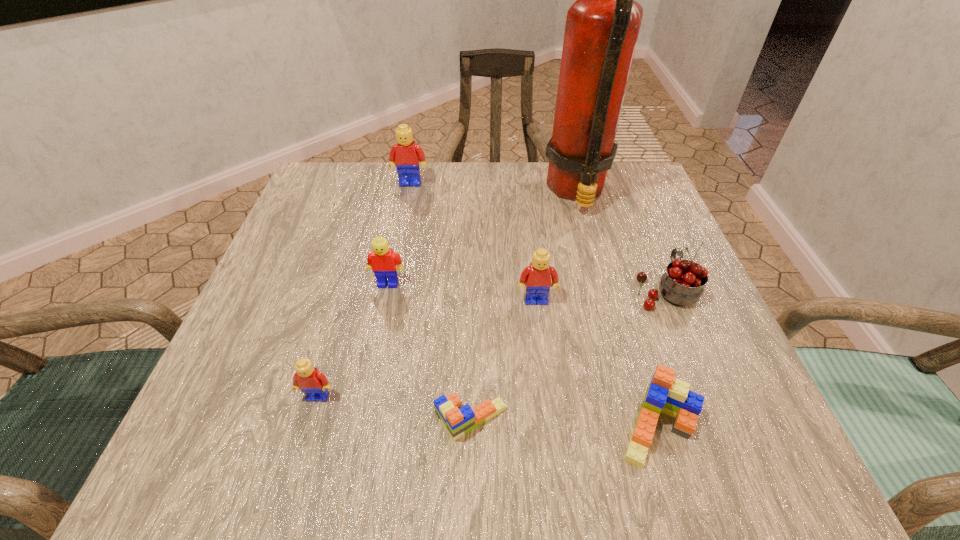
Find the location of `free location located on the handle side of the red cherry`. free location located on the handle side of the red cherry is located at coordinates [x=640, y=228].

Image resolution: width=960 pixels, height=540 pixels. In order to click on vacant space located on the handle side of the red cherry in this screenshot , I will do `click(636, 217)`.

You are a GUI agent. You are given a task and a screenshot of the screen. Output one action in this format:
    pyautogui.click(x=<x>, y=<y>)
    Task: Click on the vacant point located on the handle side of the red cherry
    This screenshot has height=540, width=960.
    Given the screenshot: What is the action you would take?
    pyautogui.click(x=636, y=220)

The height and width of the screenshot is (540, 960). Identify the location of vacant point located 0.060m on the front-facing side of the smallest yellow Lego. (305, 442).

Identify the location of vacant space located on the left of the bigger orange Lego. Image resolution: width=960 pixels, height=540 pixels. (464, 428).

Where is `free spot located on the right of the smaller orange Lego`? Image resolution: width=960 pixels, height=540 pixels. free spot located on the right of the smaller orange Lego is located at coordinates (691, 420).

Where is `fire extinguisher at the far edge`? The image size is (960, 540). fire extinguisher at the far edge is located at coordinates (602, 26).

Locate an element on the screen. The width and height of the screenshot is (960, 540). Lego that is positioned at the far edge is located at coordinates (405, 155).

Where is `object that is positioned at the left edge`? The width and height of the screenshot is (960, 540). object that is positioned at the left edge is located at coordinates (314, 384).

The image size is (960, 540). What are the coordinates of `fire extinguisher situated at the right edge` in the screenshot? It's located at (602, 26).